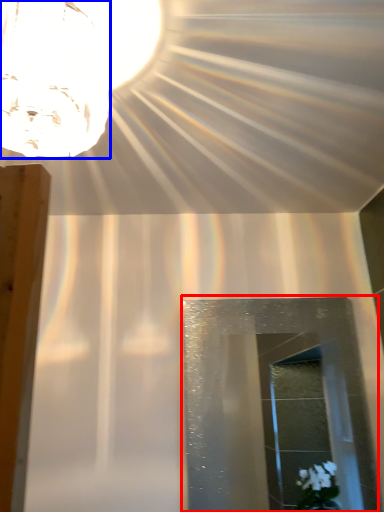
Question: Which object is closer to the camera taking this photo, glass door (highlighted by a red box) or lamp (highlighted by a blue box)?

Choices:
 (A) glass door
 (B) lamp

Answer: (B)